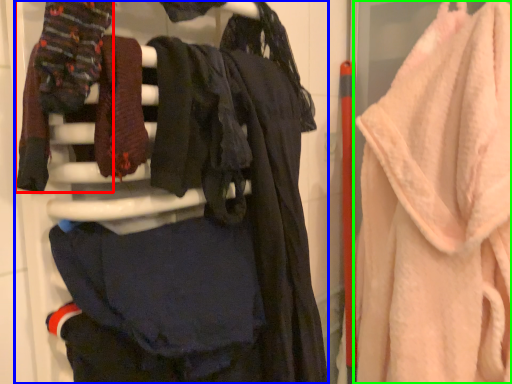
Question: Considering the real-world distances, which object is closest to clothing (highlighted by a red box)? closet (highlighted by a blue box) or towel (highlighted by a green box).

Choices:
 (A) closet
 (B) towel

Answer: (A)